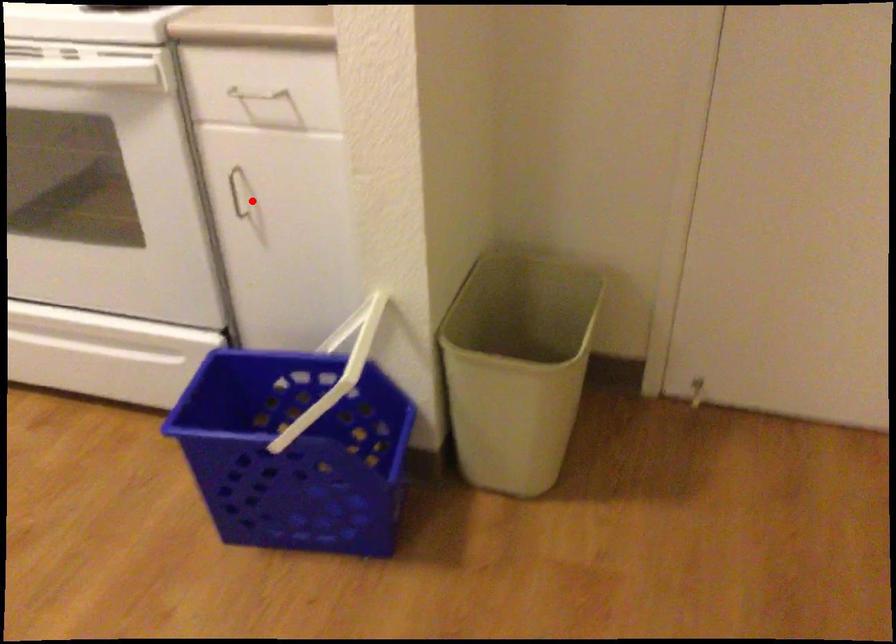
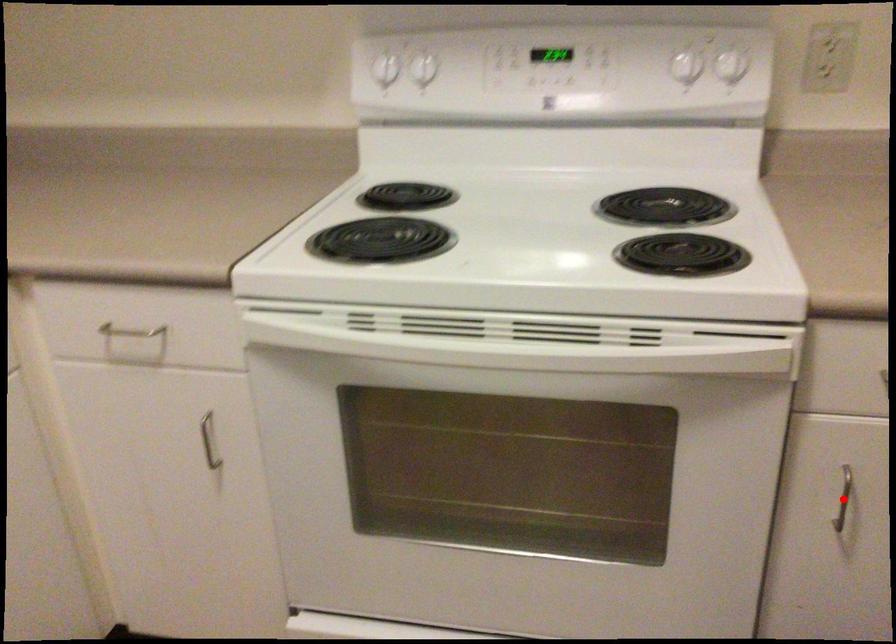
I am providing you with two images of the same scene from different viewpoints. A red point is marked on the first image and another point is marked on the second image. Does the point marked in image1 correspond to the same location as the one in image2?

Yes